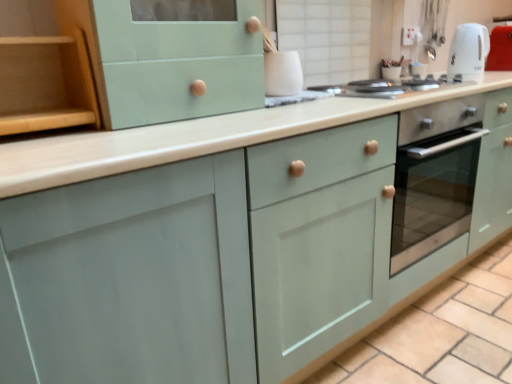
Find the location of a particular element. vacant point to the right of wooden shelf at left is located at coordinates (130, 134).